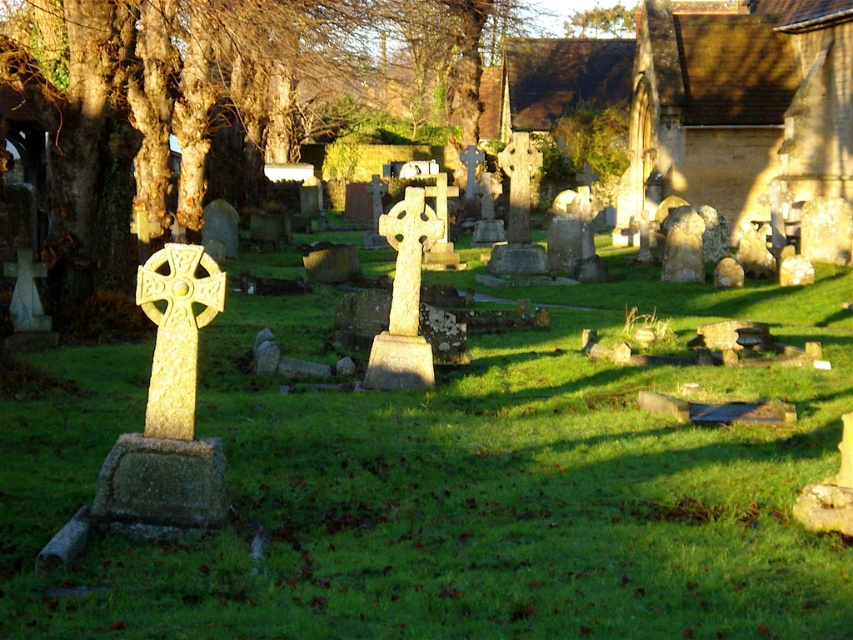
You are standing at the point labeled point (77, 285) and want to take a photo of the point labeled point (674, 372). However, there is a large tree blocking your view. Can you move to a position where both points are visible in your camera frame?

No, because point (674, 372) is closer to the camera than point (77, 285), so moving closer won

You are standing in the cemetery and want to take a photo of the stone textured church at upper right. If your camera has a maximum zoom range of 25 meters, will you be able to capture the church clearly without moving closer?

The stone textured church at upper right is 30.85 meters away from camera, which exceeds the camera maximum zoom range of 25 meters. Therefore, you cannot capture the church clearly without moving closer.